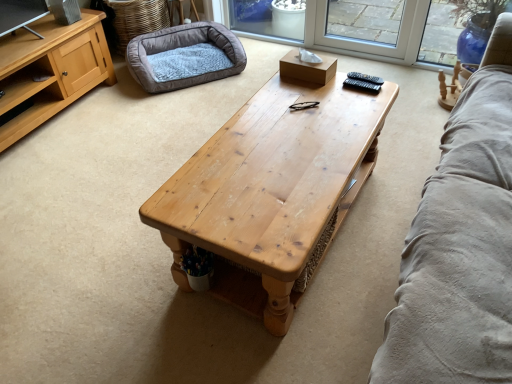
Locate an element on the screen. This screenshot has width=512, height=384. vacant region to the left of wooden coffee table at center is located at coordinates (99, 240).